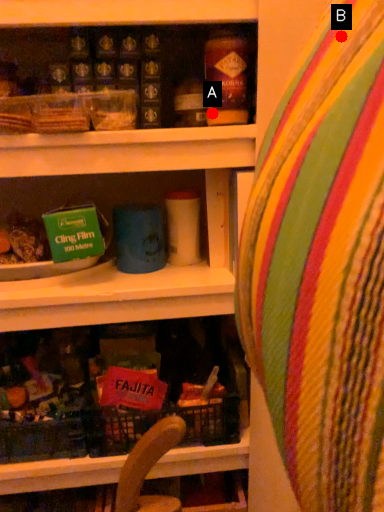
Question: Two points are circled on the image, labeled by A and B beside each circle. Among these points, which one is nearest to the camera?

Choices:
 (A) A is closer
 (B) B is closer

Answer: (B)